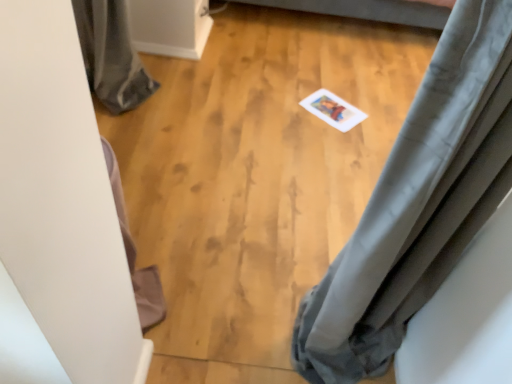
The image size is (512, 384). Find the location of `white paper at center`. white paper at center is located at coordinates (333, 110).

Describe the element at coordinates (333, 110) in the screenshot. I see `white paper at center` at that location.

At what (x,y) coordinates should I click in order to perform the action: click on white paper at center. Please return your answer as a coordinate pair (x, y). Looking at the image, I should click on [333, 110].